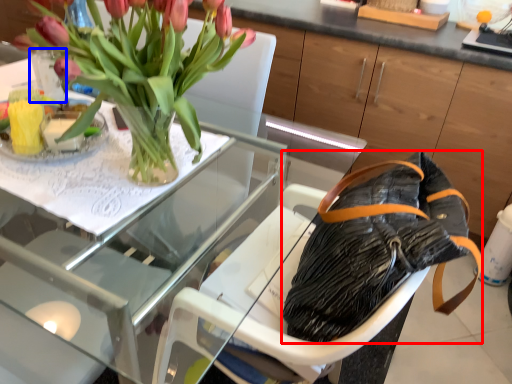
Question: Which object appears farthest to the camera in this image, handbag (highlighted by a red box) or glass vase (highlighted by a blue box)?

Choices:
 (A) handbag
 (B) glass vase

Answer: (B)